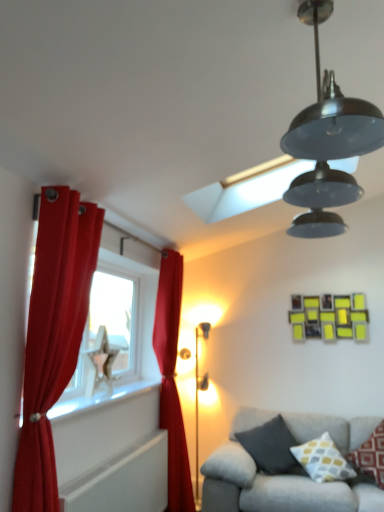
Question: Is yellow and gray patterned pillow at lower right, marked as the 2th pillow in a right-to-left arrangement, oriented towards dark gray fabric pillow at lower right, the first pillow from the left?

Choices:
 (A) no
 (B) yes

Answer: (A)

Question: From a real-world perspective, is yellow and gray patterned pillow at lower right, arranged as the 2th pillow when viewed from the left, located beneath dark gray fabric pillow at lower right, which appears as the third pillow when viewed from the right?

Choices:
 (A) yes
 (B) no

Answer: (B)

Question: Considering the relative positions of yellow and gray patterned pillow at lower right, arranged as the 2th pillow when viewed from the left, and dark gray fabric pillow at lower right, the first pillow from the left, in the image provided, is yellow and gray patterned pillow at lower right, arranged as the 2th pillow when viewed from the left, behind dark gray fabric pillow at lower right, the first pillow from the left,?

Choices:
 (A) no
 (B) yes

Answer: (A)

Question: Is yellow and gray patterned pillow at lower right, marked as the 2th pillow in a right-to-left arrangement, facing away from dark gray fabric pillow at lower right, the first pillow from the left?

Choices:
 (A) no
 (B) yes

Answer: (A)

Question: Does yellow and gray patterned pillow at lower right, marked as the 2th pillow in a right-to-left arrangement, have a greater width compared to dark gray fabric pillow at lower right, which appears as the third pillow when viewed from the right?

Choices:
 (A) yes
 (B) no

Answer: (B)

Question: From a real-world perspective, is gray fabric couch at lower right above or below yellow and gray patterned pillow at lower right, arranged as the 2th pillow when viewed from the left?

Choices:
 (A) above
 (B) below

Answer: (B)

Question: Do you think gray fabric couch at lower right is within yellow and gray patterned pillow at lower right, marked as the 2th pillow in a right-to-left arrangement, or outside of it?

Choices:
 (A) outside
 (B) inside

Answer: (A)

Question: From their relative heights in the image, would you say gray fabric couch at lower right is taller or shorter than yellow and gray patterned pillow at lower right, marked as the 2th pillow in a right-to-left arrangement?

Choices:
 (A) short
 (B) tall

Answer: (B)

Question: Relative to yellow and gray patterned pillow at lower right, marked as the 2th pillow in a right-to-left arrangement, is gray fabric couch at lower right in front or behind?

Choices:
 (A) behind
 (B) front

Answer: (B)

Question: Considering the positions of white textured radiator at lower left and gray fabric couch at lower right in the image, is white textured radiator at lower left wider or thinner than gray fabric couch at lower right?

Choices:
 (A) wide
 (B) thin

Answer: (B)

Question: Considering the relative positions of white textured radiator at lower left and gray fabric couch at lower right in the image provided, is white textured radiator at lower left to the left or to the right of gray fabric couch at lower right?

Choices:
 (A) right
 (B) left

Answer: (B)

Question: Looking at the image, does white textured radiator at lower left seem bigger or smaller compared to gray fabric couch at lower right?

Choices:
 (A) small
 (B) big

Answer: (A)

Question: Is point (96, 477) closer or farther from the camera than point (284, 482)?

Choices:
 (A) closer
 (B) farther

Answer: (A)

Question: From a real-world perspective, relative to red velvet curtain at center, marked as the 2th curtain in a front-to-back arrangement, is gray fabric couch at lower right vertically above or below?

Choices:
 (A) below
 (B) above

Answer: (A)

Question: Do you think gray fabric couch at lower right is within red velvet curtain at center, placed as the 1th curtain when sorted from back to front, or outside of it?

Choices:
 (A) outside
 (B) inside

Answer: (A)